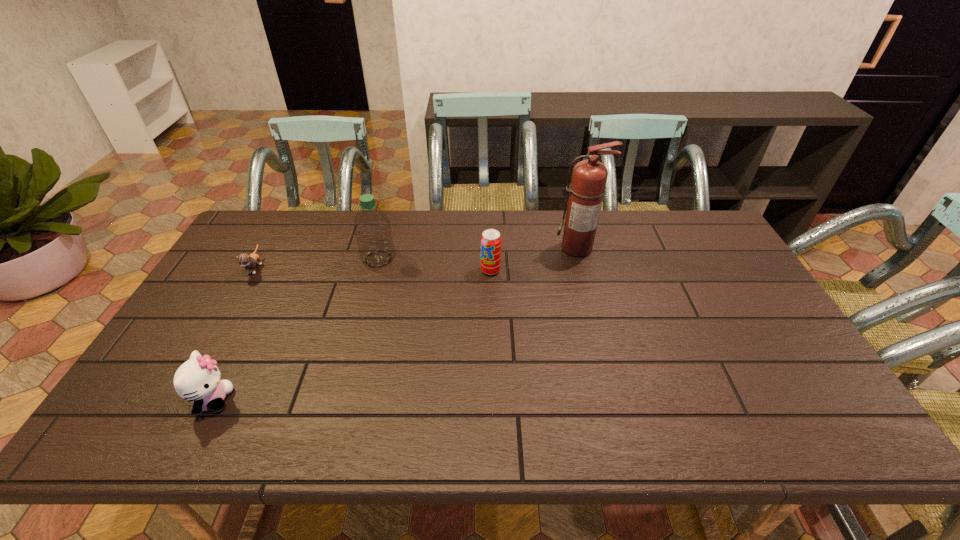
Locate an element on the screen. This screenshot has height=540, width=960. free space between the rightmost object and the third object from right to left is located at coordinates (478, 254).

The height and width of the screenshot is (540, 960). In order to click on vacant region between the soda can and the tallest object in this screenshot , I will do `click(534, 259)`.

Find the location of `object that is the fourth nearest to the nearer kitten`. object that is the fourth nearest to the nearer kitten is located at coordinates (589, 177).

Identify which object is located as the fourth nearest to the soda can. Please provide its 2D coordinates. Your answer should be formatted as a tuple, i.e. [(x, y)], where the tuple contains the x and y coordinates of a point satisfying the conditions above.

[(198, 380)]

This screenshot has height=540, width=960. Find the location of `vacant space that satisfies the following two spatial constraints: 1. on the front side of the second object from right to left; 2. on the left side of the fourth shortest object`. vacant space that satisfies the following two spatial constraints: 1. on the front side of the second object from right to left; 2. on the left side of the fourth shortest object is located at coordinates (375, 271).

Locate an element on the screen. This screenshot has height=540, width=960. free spot that satisfies the following two spatial constraints: 1. on the front side of the second object from right to left; 2. on the front-facing side of the nearest object is located at coordinates (494, 400).

The width and height of the screenshot is (960, 540). Identify the location of free point that satisfies the following two spatial constraints: 1. on the front-facing side of the soda can; 2. on the right side of the farther kitten. (254, 271).

The image size is (960, 540). Find the location of `vacant region that satisfies the following two spatial constraints: 1. on the front-facing side of the left kitten; 2. on the left side of the fourth object from left to right`. vacant region that satisfies the following two spatial constraints: 1. on the front-facing side of the left kitten; 2. on the left side of the fourth object from left to right is located at coordinates (254, 271).